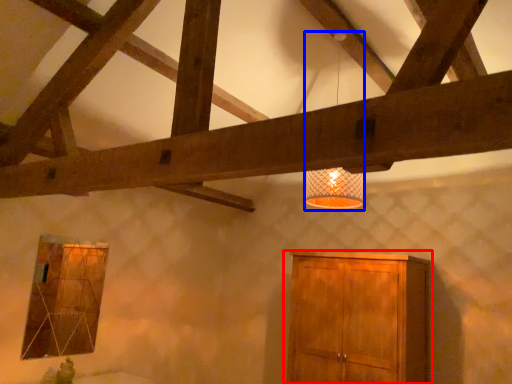
Question: Which point is further to the camera, cupboard (highlighted by a red box) or lamp (highlighted by a blue box)?

Choices:
 (A) cupboard
 (B) lamp

Answer: (A)